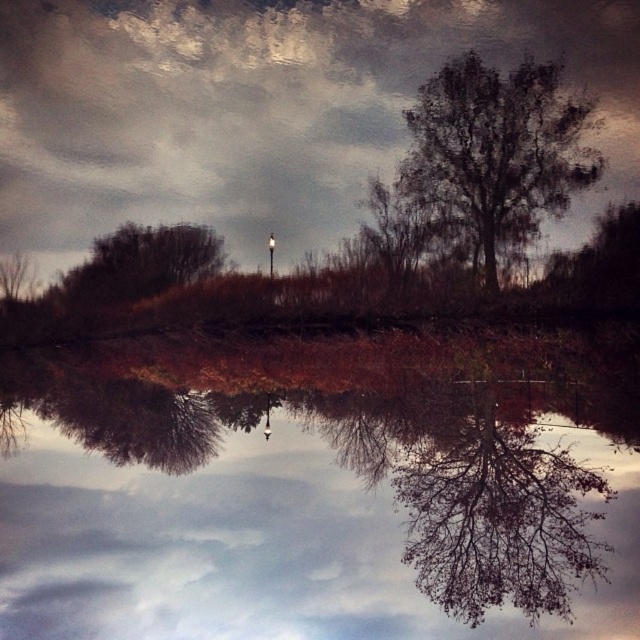
Who is higher up, transparent glass water at center or dark brown textured tree at upper right?

dark brown textured tree at upper right

Can you confirm if transparent glass water at center is thinner than dark brown textured tree at upper right?

Incorrect, transparent glass water at center's width is not less than dark brown textured tree at upper right's.

Where is `transparent glass water at center`? Image resolution: width=640 pixels, height=640 pixels. transparent glass water at center is located at coordinates (320, 488).

Does cloudy sky at upper center have a greater width compared to dark brown textured tree at upper right?

Correct, the width of cloudy sky at upper center exceeds that of dark brown textured tree at upper right.

Looking at this image, between cloudy sky at upper center and dark brown textured tree at upper right, which one has less height?

dark brown textured tree at upper right is shorter.

Identify the location of cloudy sky at upper center. Image resolution: width=640 pixels, height=640 pixels. (264, 113).

Where is `cloudy sky at upper center`? This screenshot has width=640, height=640. cloudy sky at upper center is located at coordinates (264, 113).

This screenshot has width=640, height=640. What do you see at coordinates (264, 113) in the screenshot?
I see `cloudy sky at upper center` at bounding box center [264, 113].

Is point (83, 228) closer to camera compared to point (268, 236)?

That is False.

Describe the element at coordinates (264, 113) in the screenshot. The width and height of the screenshot is (640, 640). I see `cloudy sky at upper center` at that location.

Find the location of `cloudy sky at upper center`. cloudy sky at upper center is located at coordinates (264, 113).